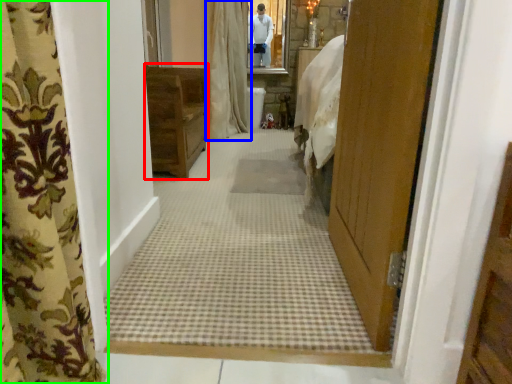
Question: Considering the real-world distances, which object is closest to furniture (highlighted by a red box)? curtain (highlighted by a blue box) or curtain (highlighted by a green box).

Choices:
 (A) curtain
 (B) curtain

Answer: (A)